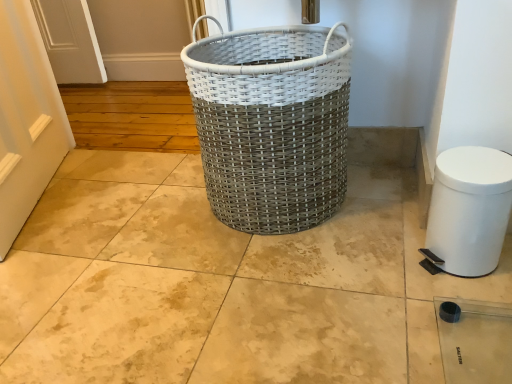
What are the coordinates of `vacant point to the left of white plastic trash can at lower right` in the screenshot? It's located at (384, 270).